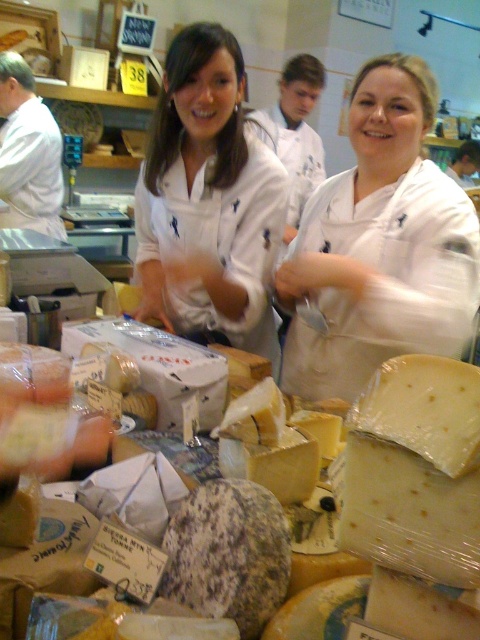
Is white matte apron at center closer to camera compared to white matte uniform at center?

Yes, it is.

Between white matte apron at center and white matte uniform at center, which one appears on the left side from the viewer's perspective?

From the viewer's perspective, white matte uniform at center appears more on the left side.

Who is more distant from viewer, (432, 227) or (239, 228)?

Point (239, 228)

You are a GUI agent. You are given a task and a screenshot of the screen. Output one action in this format:
    pyautogui.click(x=<x>, y=<y>)
    Task: Click on the white matte apron at center
    This screenshot has height=640, width=480.
    Given the screenshot: What is the action you would take?
    pyautogui.click(x=381, y=244)